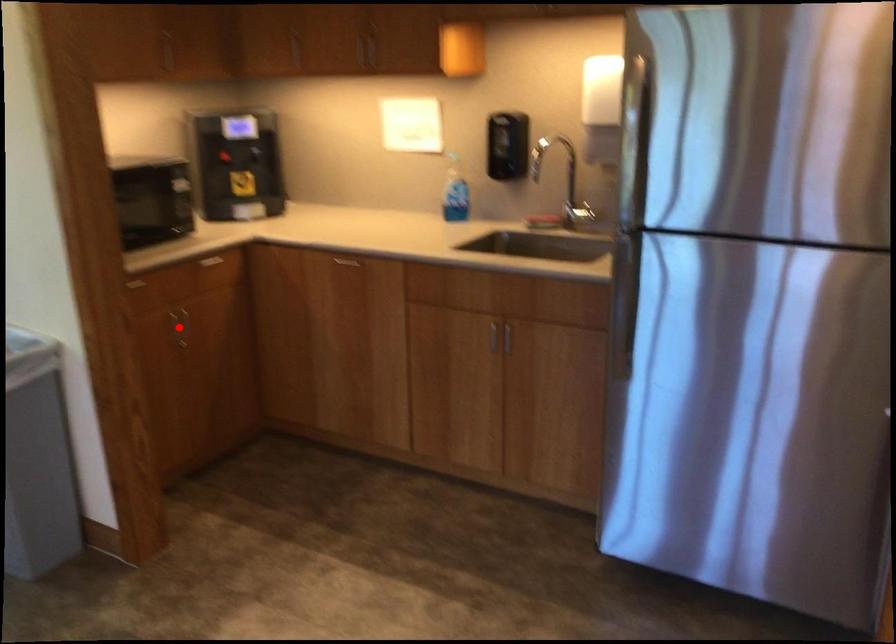
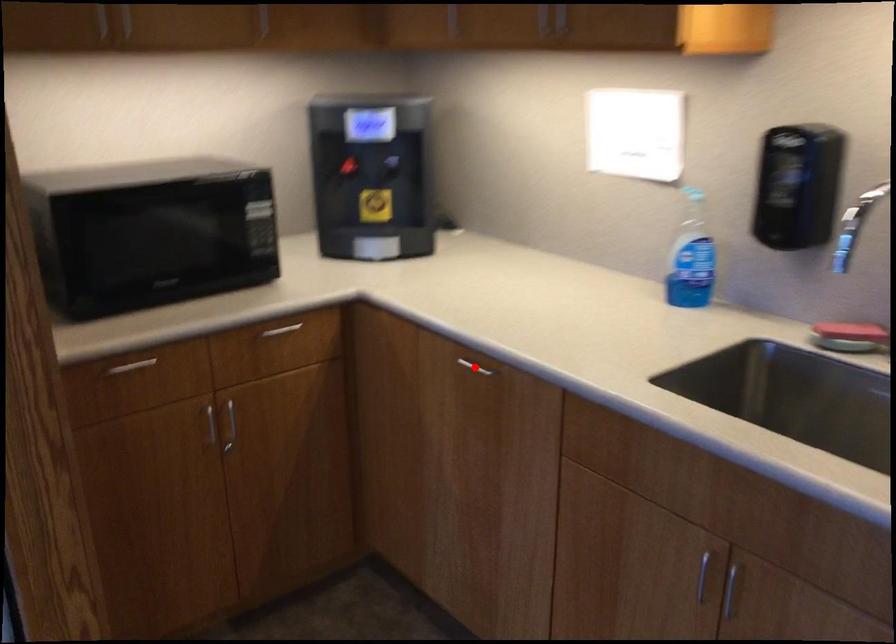
I am providing you with two images of the same scene from different viewpoints. A red point is marked on the first image and another point is marked on the second image. Are the points marked in image1 and image2 representing the same 3D position?

No